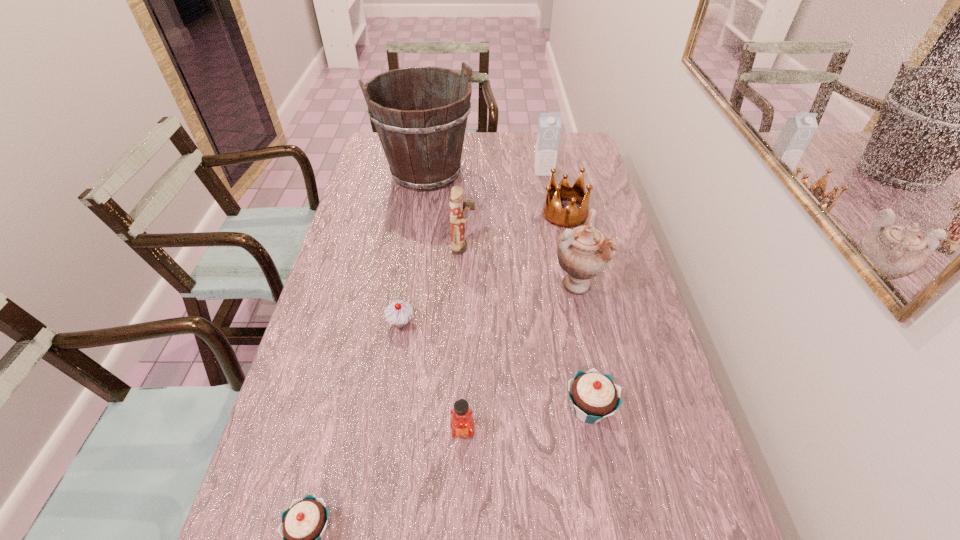
This screenshot has height=540, width=960. What are the coordinates of `vacant space that's between the fifth farthest object and the fourth farthest object` in the screenshot? It's located at (519, 266).

Where is `vacant space that is in between the gray cupcake and the bucket`? The height and width of the screenshot is (540, 960). vacant space that is in between the gray cupcake and the bucket is located at coordinates (414, 248).

What are the coordinates of `free space between the crown and the rightmost cupcake` in the screenshot? It's located at (577, 312).

Identify which object is the second nearest to the second cupcake from right to left. Please provide its 2D coordinates. Your answer should be formatted as a tuple, i.e. [(x, y)], where the tuple contains the x and y coordinates of a point satisfying the conditions above.

[(462, 424)]

Select which object appears as the seventh closest to the urn. Please provide its 2D coordinates. Your answer should be formatted as a tuple, i.e. [(x, y)], where the tuple contains the x and y coordinates of a point satisfying the conditions above.

[(549, 124)]

Select which cupcake is the closest to the right teal cupcake. Please provide its 2D coordinates. Your answer should be formatted as a tuple, i.e. [(x, y)], where the tuple contains the x and y coordinates of a point satisfying the conditions above.

[(399, 313)]

What are the coordinates of `cupcake that is the third nearest to the fifth nearest object` in the screenshot? It's located at (303, 525).

Find the location of a particular element. The width and height of the screenshot is (960, 540). free spot that satisfies the following two spatial constraints: 1. on the front label of the second nearest cupcake; 2. on the right side of the carton is located at coordinates (588, 410).

Locate an element on the screen. The image size is (960, 540). blank space that satisfies the following two spatial constraints: 1. on the front-facing side of the farther teal cupcake; 2. on the right side of the figurine is located at coordinates (457, 410).

Image resolution: width=960 pixels, height=540 pixels. Find the location of `free space that satisfies the following two spatial constraints: 1. on the front-facing side of the figurine; 2. on the right side of the second farthest cupcake`. free space that satisfies the following two spatial constraints: 1. on the front-facing side of the figurine; 2. on the right side of the second farthest cupcake is located at coordinates (457, 410).